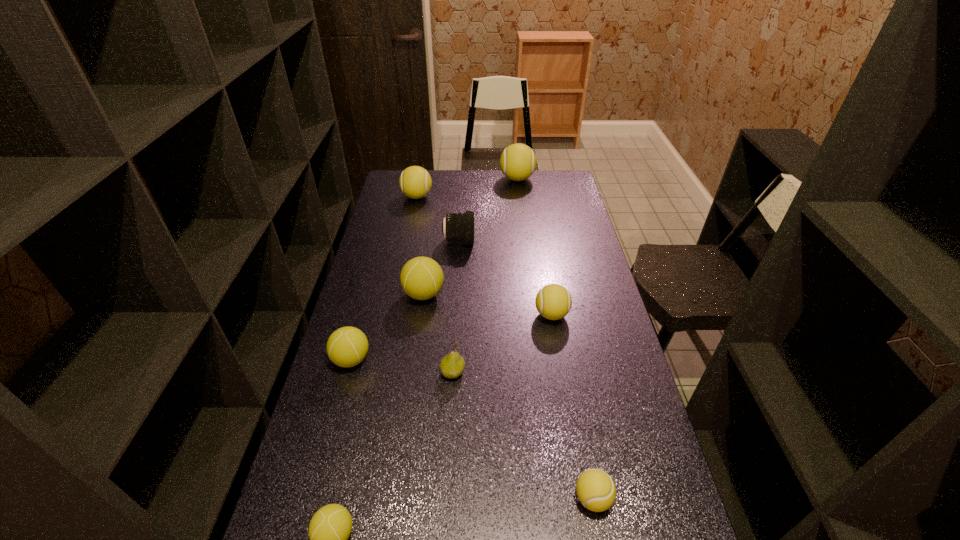
Identify the location of blank area located on the left of the nearest yellow tennis ball. (497, 498).

Find the location of a particular element. The height and width of the screenshot is (540, 960). object that is at the far left corner is located at coordinates (415, 182).

In order to click on vacant space at the far edge in this screenshot , I will do `click(439, 173)`.

At what (x,y) coordinates should I click in order to perform the action: click on free point at the left edge. Please return your answer as a coordinate pair (x, y). This screenshot has height=540, width=960. Looking at the image, I should click on (369, 425).

Locate an element on the screen. free space at the right edge is located at coordinates (632, 515).

Where is `vacant region between the third farthest yellow tennis ball and the rightmost green tennis ball`? The height and width of the screenshot is (540, 960). vacant region between the third farthest yellow tennis ball and the rightmost green tennis ball is located at coordinates (488, 305).

At what (x,y) coordinates should I click in order to perform the action: click on vacant area between the second farthest yellow tennis ball and the second smallest yellow tennis ball. Please return your answer as a coordinate pair (x, y). Looking at the image, I should click on (484, 256).

Locate an element on the screen. unoccupied area between the green pear and the third biggest yellow tennis ball is located at coordinates (502, 343).

At what (x,y) coordinates should I click in order to perform the action: click on vacant space that is in between the second farthest tennis ball and the second farthest green tennis ball. Please return your answer as a coordinate pair (x, y). This screenshot has width=960, height=540. Looking at the image, I should click on (384, 278).

I want to click on blank region between the telephoto lens and the second smallest green tennis ball, so click(405, 300).